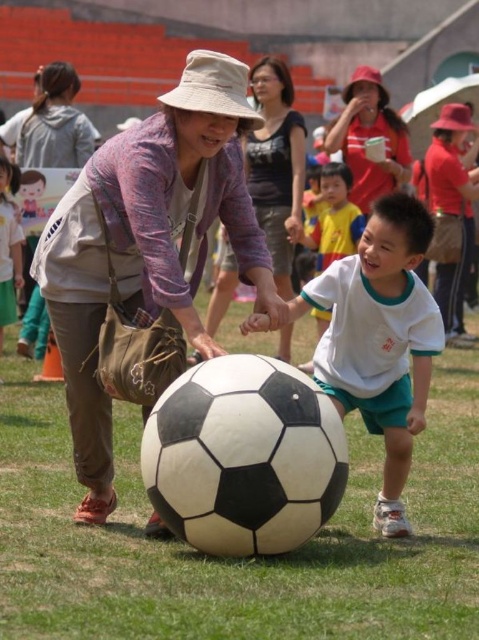
Question: Among these points, which one is farthest from the camera?

Choices:
 (A) (42, 156)
 (B) (353, 102)
 (C) (387, 381)

Answer: (A)

Question: Which point appears farthest from the camera in this image?

Choices:
 (A) (262, 220)
 (B) (101, 189)

Answer: (A)

Question: Is white matte soccer ball at center smaller than matte purple sweater at center?

Choices:
 (A) yes
 (B) no

Answer: (B)

Question: Does matte purple sweater at center appear over white matte shirt at center?

Choices:
 (A) no
 (B) yes

Answer: (B)

Question: Does white matte soccer ball at center have a greater width compared to matte gray hoodie at upper left?

Choices:
 (A) no
 (B) yes

Answer: (B)

Question: Which object is farther from the camera taking this photo?

Choices:
 (A) black matte soccer ball at center
 (B) matte red bucket hat at upper center

Answer: (B)